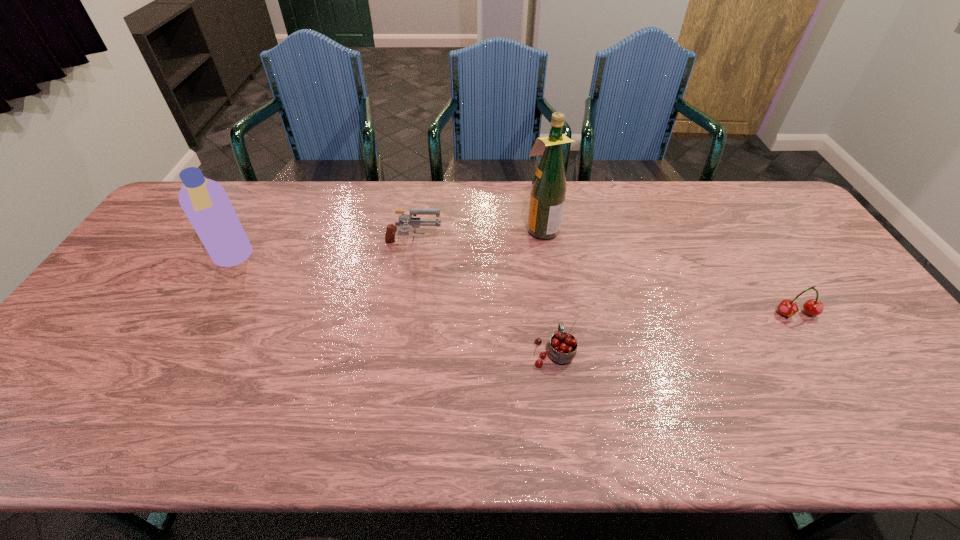
Identify the location of vacant area located on the front-facing side of the liquor. (493, 228).

I want to click on vacant space positioned on the front-facing side of the liquor, so click(x=462, y=228).

Locate an element on the screen. vacant space located on the front of the shampoo is located at coordinates (205, 308).

I want to click on vacant space located at the barrel end of the fourth object from right to left, so click(468, 245).

Where is `free space located 0.130m with stems pointing upwards on the farther cherry`? free space located 0.130m with stems pointing upwards on the farther cherry is located at coordinates (828, 363).

Identify the location of free space located 0.170m on the handle side of the left cherry. point(544,286).

At what (x,y) coordinates should I click in order to perform the action: click on free space located 0.190m on the handle side of the left cherry. Please return your answer as a coordinate pair (x, y). Looking at the image, I should click on (544, 281).

This screenshot has width=960, height=540. In order to click on free space located on the handle side of the left cherry in this screenshot , I will do `click(538, 233)`.

Find the location of a particular element. This screenshot has height=540, width=960. object that is at the far edge is located at coordinates (548, 190).

Locate an element on the screen. The image size is (960, 540). object present at the right edge is located at coordinates (814, 307).